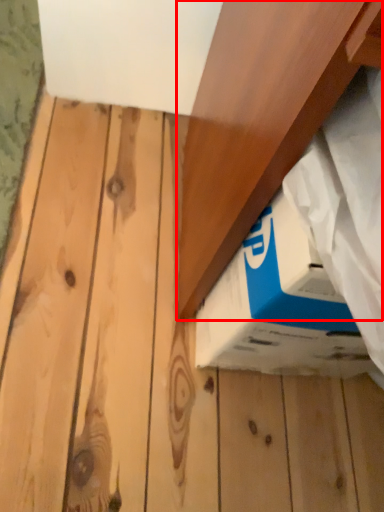
Question: In this image, where is plank (annotated by the red box) located relative to box?

Choices:
 (A) left
 (B) right

Answer: (B)